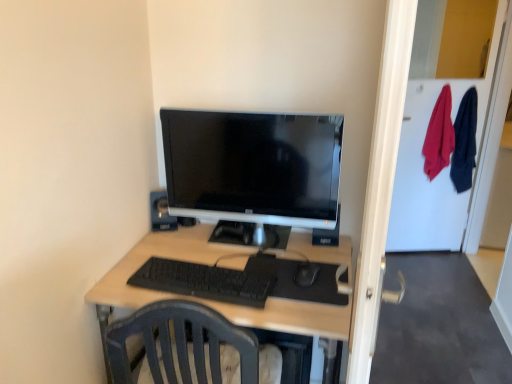
The width and height of the screenshot is (512, 384). I want to click on vacant region under satin black monitor at center (from a real-world perspective), so click(x=247, y=242).